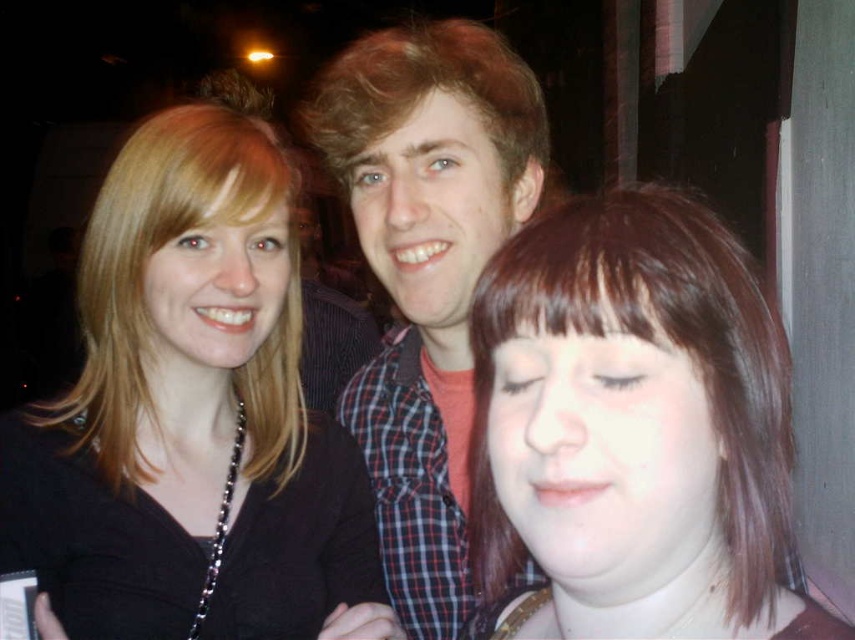
Locate an element on the screen. matte black shirt at left is located at coordinates (192, 413).

How much distance is there between matte black shirt at left and plaid shirt at center?

matte black shirt at left is 6.90 inches from plaid shirt at center.

Describe the element at coordinates (192, 413) in the screenshot. The image size is (855, 640). I see `matte black shirt at left` at that location.

Image resolution: width=855 pixels, height=640 pixels. I want to click on matte black shirt at left, so click(192, 413).

Can you confirm if plaid shirt at center is positioned to the right of blondehair at center?

Correct, you'll find plaid shirt at center to the right of blondehair at center.

How distant is plaid shirt at center from blondehair at center?

The distance of plaid shirt at center from blondehair at center is 4.18 meters.

Does point (440, 102) lie in front of point (346, 173)?

Yes, it is in front of point (346, 173).

Where is `plaid shirt at center`? Image resolution: width=855 pixels, height=640 pixels. plaid shirt at center is located at coordinates (428, 272).

Is matte black shirt at left further to the viewer compared to brown hair at center?

Yes, it is behind brown hair at center.

Is point (125, 429) less distant than point (540, 406)?

No, (125, 429) is further to viewer.

Identify the location of matte black shirt at left. The height and width of the screenshot is (640, 855). (192, 413).